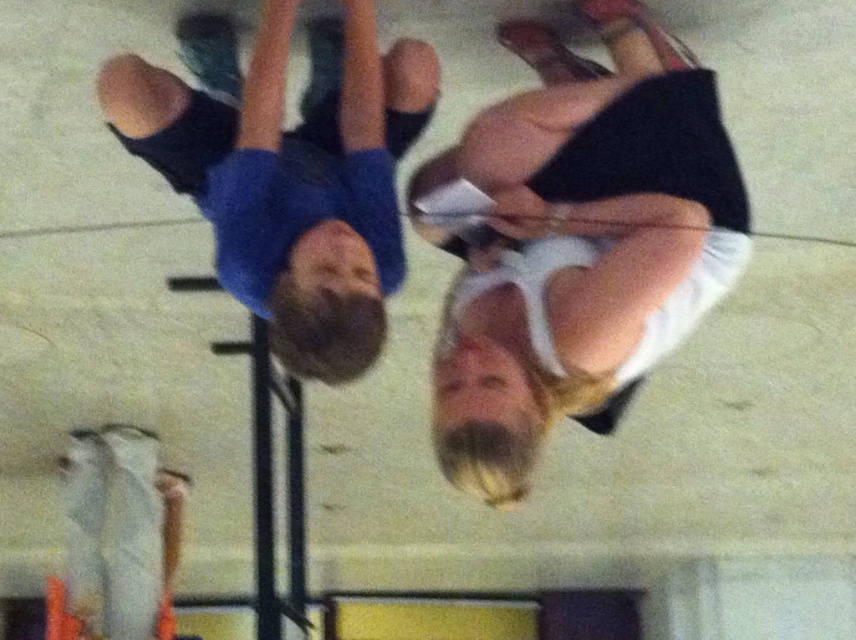
You are a photographer trying to capture a group photo of the people in the gym. You notice the white matte skirt at center and the blue cotton shirt at upper left. Which clothing item should you focus on first if you want to ensure both are in frame without adjusting your camera angle?

The white matte skirt at center is narrower than the blue cotton shirt at upper left, so focusing on the blue cotton shirt at upper left first would ensure there is enough space in the frame to include both items since it takes up more width.

You are a photographer trying to capture a closeup of the blue cotton shirt at upper left and the white matte skirt at center. Since the image is rotated, you need to adjust your camera angle. Considering their sizes, which object should you focus on first to ensure it fits in the frame?

The white matte skirt at center is larger in size than the blue cotton shirt at upper left, so you should focus on the white matte skirt at center first to ensure it fits in the frame before adjusting for the smaller blue cotton shirt at upper left.